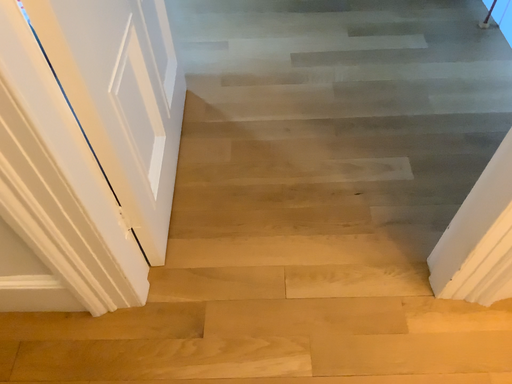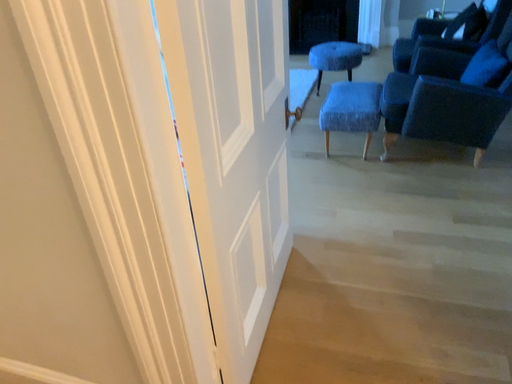
Question: How did the camera likely rotate when shooting the video?

Choices:
 (A) rotated left
 (B) rotated right

Answer: (A)